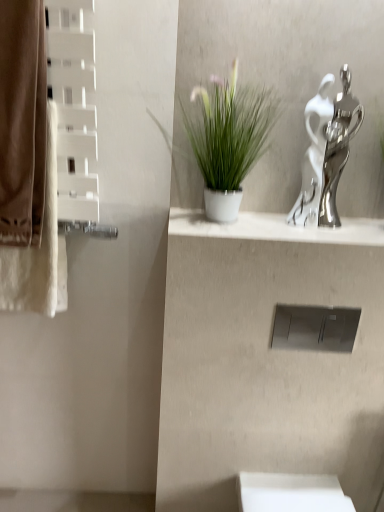
Question: Is brown cotton bath towel at left aimed at brown fabric curtain at left?

Choices:
 (A) no
 (B) yes

Answer: (B)

Question: Is brown cotton bath towel at left not inside brown fabric curtain at left?

Choices:
 (A) no
 (B) yes

Answer: (A)

Question: From a real-world perspective, is brown cotton bath towel at left over brown fabric curtain at left?

Choices:
 (A) no
 (B) yes

Answer: (A)

Question: Is brown cotton bath towel at left smaller than brown fabric curtain at left?

Choices:
 (A) yes
 (B) no

Answer: (B)

Question: Can brown fabric curtain at left be found inside brown cotton bath towel at left?

Choices:
 (A) no
 (B) yes

Answer: (B)

Question: Considering the positions of point (319, 169) and point (256, 117), is point (319, 169) closer or farther from the camera than point (256, 117)?

Choices:
 (A) closer
 (B) farther

Answer: (A)

Question: Looking at their shapes, would you say silver metallic sculpture at upper right is wider or thinner than green matte plant at center?

Choices:
 (A) thin
 (B) wide

Answer: (A)

Question: Relative to green matte plant at center, is silver metallic sculpture at upper right in front or behind?

Choices:
 (A) front
 (B) behind

Answer: (B)

Question: Is silver metallic sculpture at upper right bigger or smaller than green matte plant at center?

Choices:
 (A) small
 (B) big

Answer: (A)

Question: From the image's perspective, is silver metallic sculpture at upper right located above or below brown fabric curtain at left?

Choices:
 (A) below
 (B) above

Answer: (A)

Question: Would you say silver metallic sculpture at upper right is inside or outside brown fabric curtain at left?

Choices:
 (A) outside
 (B) inside

Answer: (A)

Question: Is silver metallic sculpture at upper right to the left or to the right of brown fabric curtain at left in the image?

Choices:
 (A) right
 (B) left

Answer: (A)

Question: Looking at their shapes, would you say silver metallic sculpture at upper right is wider or thinner than brown fabric curtain at left?

Choices:
 (A) wide
 (B) thin

Answer: (B)

Question: From their relative heights in the image, would you say brown cotton bath towel at left is taller or shorter than silver metallic sculpture at upper right?

Choices:
 (A) short
 (B) tall

Answer: (B)

Question: Based on their positions, is brown cotton bath towel at left located to the left or right of silver metallic sculpture at upper right?

Choices:
 (A) right
 (B) left

Answer: (B)